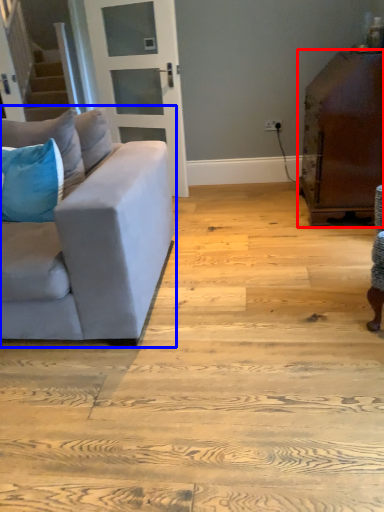
Question: Which point is closer to the camera, table (highlighted by a red box) or studio couch (highlighted by a blue box)?

Choices:
 (A) table
 (B) studio couch

Answer: (B)